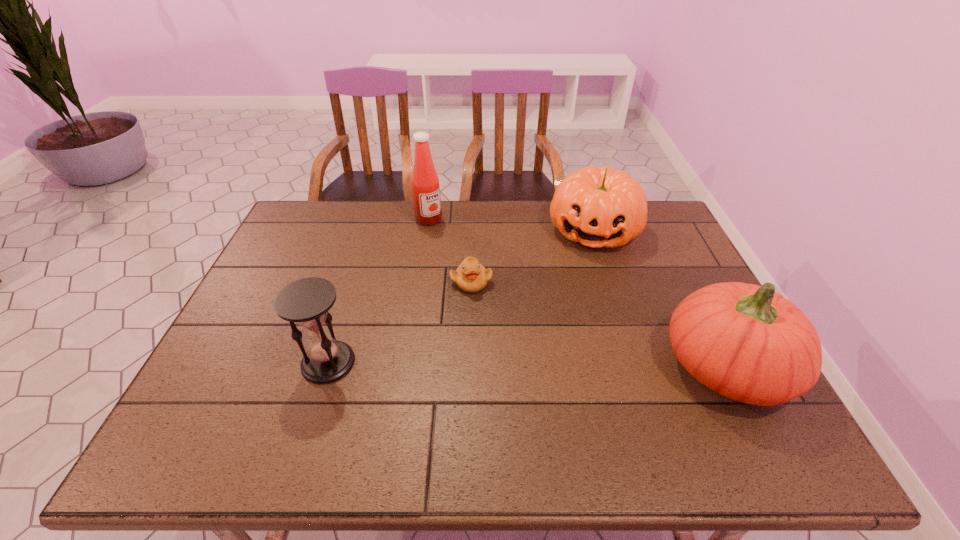
I want to click on hourglass, so click(306, 301).

Image resolution: width=960 pixels, height=540 pixels. In order to click on the taller pumpkin in this screenshot , I will do coord(748,343).

You are a GUI agent. You are given a task and a screenshot of the screen. Output one action in this format:
    pyautogui.click(x=<x>, y=<y>)
    Task: Click on the shortest object
    The width and height of the screenshot is (960, 540).
    Given the screenshot: What is the action you would take?
    pyautogui.click(x=471, y=276)

Where is `the third farthest object`? The image size is (960, 540). the third farthest object is located at coordinates (471, 276).

Locate an element on the screen. The image size is (960, 540). the farther pumpkin is located at coordinates (598, 207).

The width and height of the screenshot is (960, 540). In order to click on condiment in this screenshot , I will do `click(425, 184)`.

Find the location of a particular element. the second object from left to right is located at coordinates (425, 184).

The image size is (960, 540). Identify the location of vacant space positioned on the right of the leftmost object. (442, 363).

At what (x,y) coordinates should I click in order to perform the action: click on vacant space located 0.320m on the back of the taller pumpkin. Please return your answer as a coordinate pair (x, y). Looking at the image, I should click on (665, 246).

At what (x,y) coordinates should I click in order to perform the action: click on vacant space located at the beak of the shortest object. Please return your answer as a coordinate pair (x, y). This screenshot has width=960, height=540. Looking at the image, I should click on (471, 322).